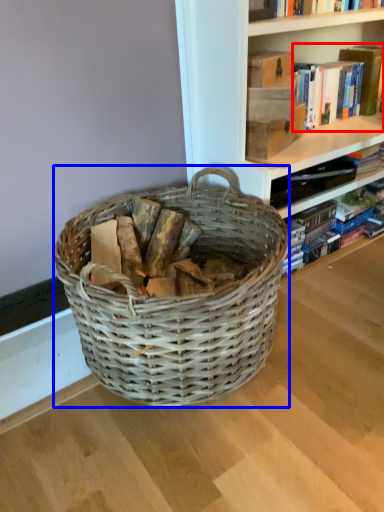
Question: Which object appears closest to the camera in this image, book (highlighted by a red box) or picnic basket (highlighted by a blue box)?

Choices:
 (A) book
 (B) picnic basket

Answer: (B)